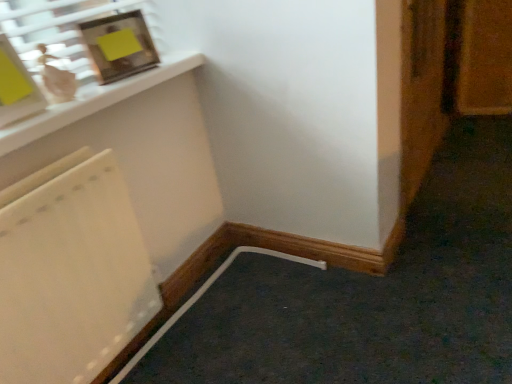
The height and width of the screenshot is (384, 512). What do you see at coordinates (119, 46) in the screenshot? I see `metallic silver picture frame at upper left` at bounding box center [119, 46].

I want to click on metallic silver picture frame at upper left, so click(119, 46).

Identify the location of wooden door at right. (421, 91).

What do you see at coordinates (421, 91) in the screenshot?
I see `wooden door at right` at bounding box center [421, 91].

Measure the distance between point (418, 135) and camera.

Point (418, 135) and camera are 6.71 feet apart.

Image resolution: width=512 pixels, height=384 pixels. Identify the location of metallic silver picture frame at upper left. (119, 46).

Is wooden door at right at the right side of metallic silver picture frame at upper left?

Indeed, wooden door at right is positioned on the right side of metallic silver picture frame at upper left.

In the scene shown: Is the depth of wooden door at right less than that of metallic silver picture frame at upper left?

No, it is not.

Between point (402, 121) and point (146, 50), which one is positioned behind?

Point (402, 121)

Looking at this image, from the image's perspective, is wooden door at right above or below metallic silver picture frame at upper left?

Clearly, from the image's perspective, wooden door at right is above metallic silver picture frame at upper left.

From a real-world perspective, relative to metallic silver picture frame at upper left, is wooden door at right vertically above or below?

wooden door at right is situated lower than metallic silver picture frame at upper left in the real world.

Which object is wider, wooden door at right or metallic silver picture frame at upper left?

wooden door at right.

In terms of height, does wooden door at right look taller or shorter compared to metallic silver picture frame at upper left?

Considering their sizes, wooden door at right has more height than metallic silver picture frame at upper left.

Can you confirm if wooden door at right is smaller than metallic silver picture frame at upper left?

No.

Is wooden door at right spatially inside metallic silver picture frame at upper left, or outside of it?

wooden door at right is not enclosed by metallic silver picture frame at upper left.

Is wooden door at right placed right next to metallic silver picture frame at upper left?

wooden door at right and metallic silver picture frame at upper left are clearly separated.

Is wooden door at right turned away from metallic silver picture frame at upper left?

wooden door at right is not turned away from metallic silver picture frame at upper left.

How different are the orientations of wooden door at right and metallic silver picture frame at upper left in degrees?

wooden door at right and metallic silver picture frame at upper left are facing 7.82 degrees away from each other.

Locate an element on the screen. door above the metallic silver picture frame at upper left (from the image's perspective) is located at coordinates (421, 91).

Which is more to the right, metallic silver picture frame at upper left or wooden door at right?

Positioned to the right is wooden door at right.

Relative to wooden door at right, is metallic silver picture frame at upper left in front or behind?

metallic silver picture frame at upper left is positioned closer to the viewer than wooden door at right.

Does point (111, 57) appear closer or farther from the camera than point (437, 25)?

Point (111, 57) is positioned closer to the camera compared to point (437, 25).

From the image's perspective, who appears lower, metallic silver picture frame at upper left or wooden door at right?

From the image's view, metallic silver picture frame at upper left is below.

Consider the image. From a real-world perspective, which object rests below the other?

wooden door at right.

In terms of width, does metallic silver picture frame at upper left look wider or thinner when compared to wooden door at right?

Considering their sizes, metallic silver picture frame at upper left looks slimmer than wooden door at right.

Considering the sizes of objects metallic silver picture frame at upper left and wooden door at right in the image provided, who is shorter, metallic silver picture frame at upper left or wooden door at right?

metallic silver picture frame at upper left.

Considering the sizes of objects metallic silver picture frame at upper left and wooden door at right in the image provided, who is bigger, metallic silver picture frame at upper left or wooden door at right?

wooden door at right.

In the scene shown: Does metallic silver picture frame at upper left contain wooden door at right?

No.

Are metallic silver picture frame at upper left and wooden door at right making contact?

No, metallic silver picture frame at upper left is not in contact with wooden door at right.

Is metallic silver picture frame at upper left facing away from wooden door at right?

No, metallic silver picture frame at upper left is not facing the opposite direction of wooden door at right.

Consider the image. How many degrees apart are the facing directions of metallic silver picture frame at upper left and wooden door at right?

The angular difference between metallic silver picture frame at upper left and wooden door at right is 7.82 degrees.

Measure the distance between metallic silver picture frame at upper left and wooden door at right.

They are 3.71 feet apart.

Locate an element on the screen. The image size is (512, 384). door that appears on the right of metallic silver picture frame at upper left is located at coordinates (421, 91).

The height and width of the screenshot is (384, 512). I want to click on picture frame on the left of wooden door at right, so click(x=119, y=46).

Where is `door below the metallic silver picture frame at upper left (from a real-world perspective)`? door below the metallic silver picture frame at upper left (from a real-world perspective) is located at coordinates (421, 91).